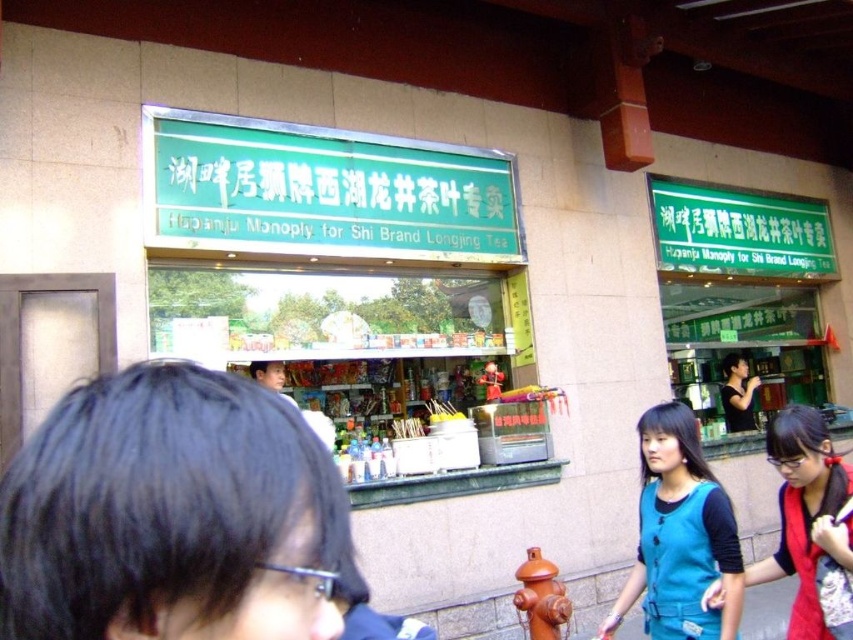
You are standing in front of the Hupanjju Monoply store. There is a point marked at coordinates point (816, 493). If you want to reach this point without moving your feet, can you touch it with your outstretched hand?

The point (816, 493) is 9.24 feet away from viewer. Since the average human arm length is about 2.5 feet, you cannot reach it with your outstretched hand.

You are standing in front of the store and want to locate the teal fabric vest at center. According to the image, where exactly is it positioned?

The teal fabric vest at center is positioned at point 0.836 on the x axis and 0.798 on the y axis.

You are a tailor measuring the distance between two clothing items in a store window display. The items are the teal fabric vest at center and the blue fabric pants at lower center. The store requires that the display items must be at least 7 feet apart for visibility. Can you confirm if the current spacing meets this requirement?

The teal fabric vest at center and blue fabric pants at lower center are 8.06 feet apart, which exceeds the required 7 feet minimum distance. Therefore, the current spacing meets the store requirement.